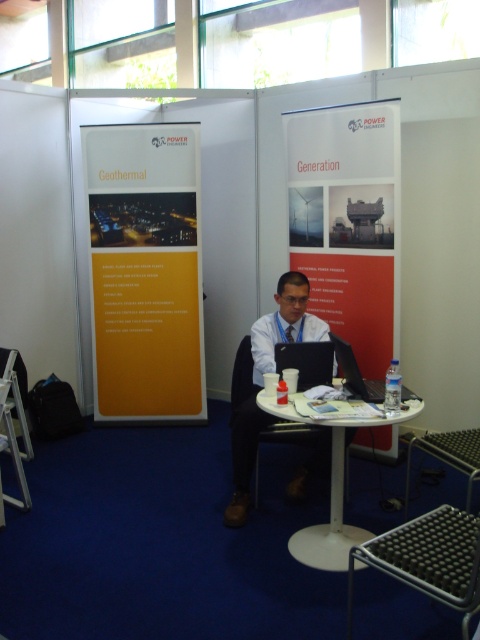
Which is behind, point (282, 296) or point (279, 416)?

Positioned behind is point (282, 296).

Is matte black suit at center closer to the viewer compared to white plastic table at center?

No, it is not.

Between point (245, 500) and point (285, 413), which one is positioned in front?

Point (285, 413)

Locate an element on the screen. The height and width of the screenshot is (640, 480). matte black suit at center is located at coordinates (263, 380).

Between matte black suit at center and black matte laptop at center, which one has more height?

Standing taller between the two is matte black suit at center.

At what (x,y) coordinates should I click in order to perform the action: click on matte black suit at center. Please return your answer as a coordinate pair (x, y). The height and width of the screenshot is (640, 480). Looking at the image, I should click on (263, 380).

Can you confirm if metallic mesh chair at lower right is wider than white plastic table at center?

In fact, metallic mesh chair at lower right might be narrower than white plastic table at center.

Locate an element on the screen. The image size is (480, 640). metallic mesh chair at lower right is located at coordinates (429, 560).